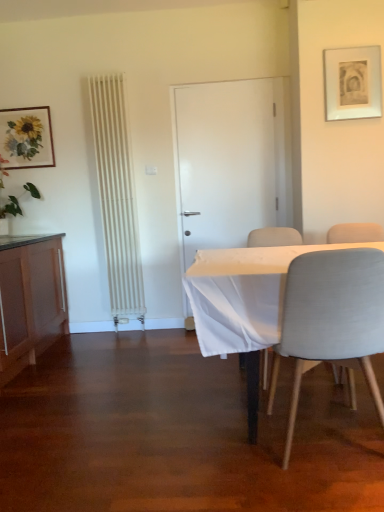
Identify the location of vacant space situated on the left part of white matte door at center. (169, 335).